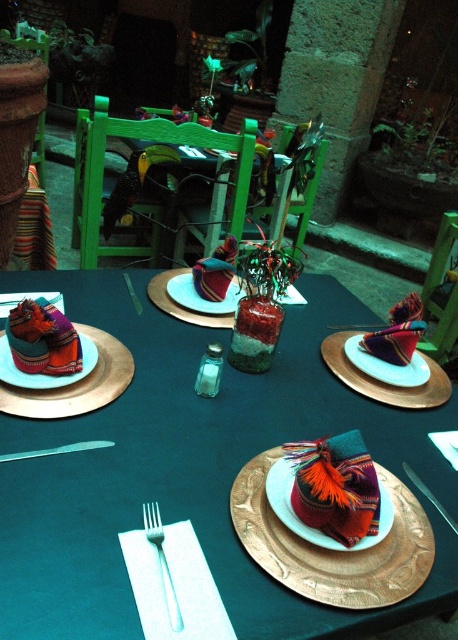
Question: Which point is closer to the camera?

Choices:
 (A) (101, 444)
 (B) (80, 371)

Answer: (A)

Question: Can you confirm if matte blue plate at left is thinner than white ceramic plate at center?

Choices:
 (A) yes
 (B) no

Answer: (B)

Question: Does textured fabric pouch at center appear on the right side of metallic knife at center?

Choices:
 (A) yes
 (B) no

Answer: (B)

Question: Which point is farther to the camera?

Choices:
 (A) (85, 380)
 (B) (136, 301)
 (C) (343, 339)
 (D) (21, 451)

Answer: (C)

Question: Which point appears farthest from the camera in this image?

Choices:
 (A) (398, 365)
 (B) (418, 488)
 (C) (91, 392)

Answer: (A)

Question: Does matte glass plate at center have a greater width compared to silver fork at upper center?

Choices:
 (A) no
 (B) yes

Answer: (B)